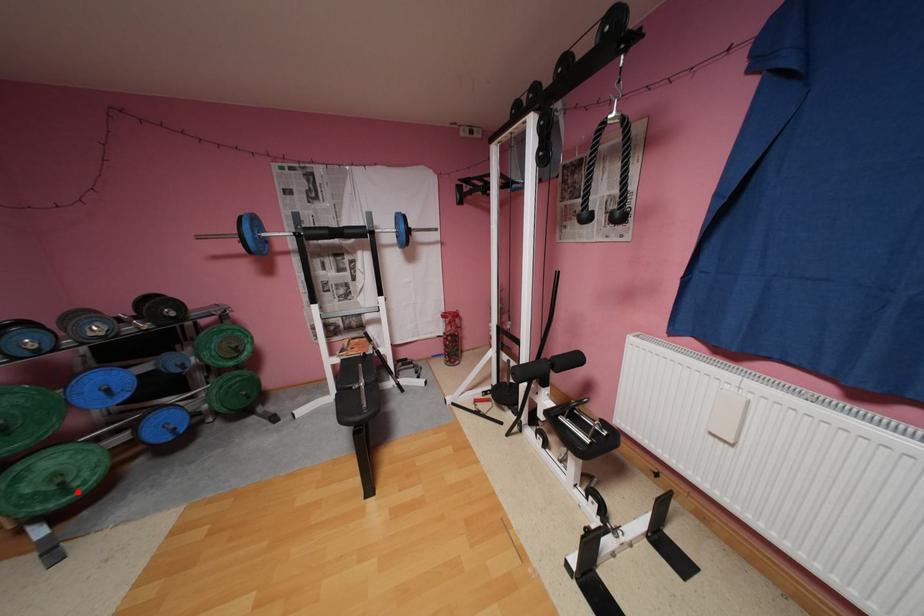
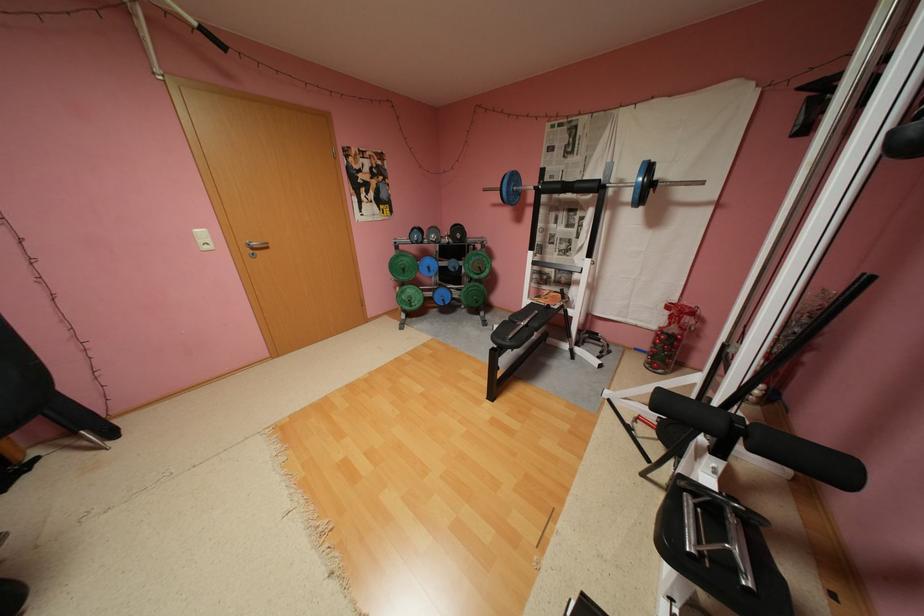
The point at the highlighted location is marked in the first image. Where is the corresponding point in the second image?

(419, 306)